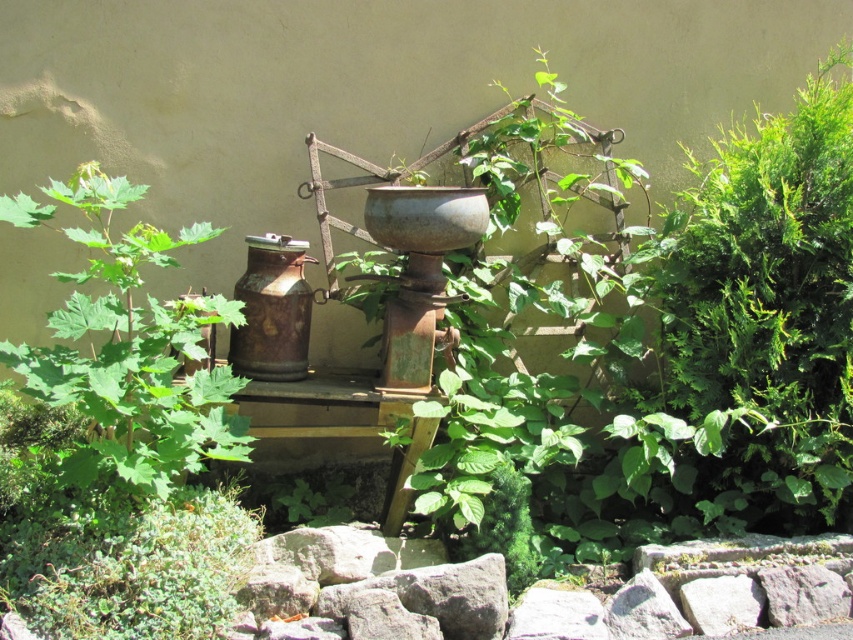
Question: Does green leafy bush at right have a smaller size compared to green leafy plant at left?

Choices:
 (A) yes
 (B) no

Answer: (B)

Question: Which of the following is the farthest from the observer?

Choices:
 (A) green leafy bush at right
 (B) green leafy plant at left

Answer: (A)

Question: Does green leafy bush at right have a larger size compared to green leafy plant at left?

Choices:
 (A) yes
 (B) no

Answer: (A)

Question: Does green leafy bush at right lie in front of green leafy plant at left?

Choices:
 (A) no
 (B) yes

Answer: (A)